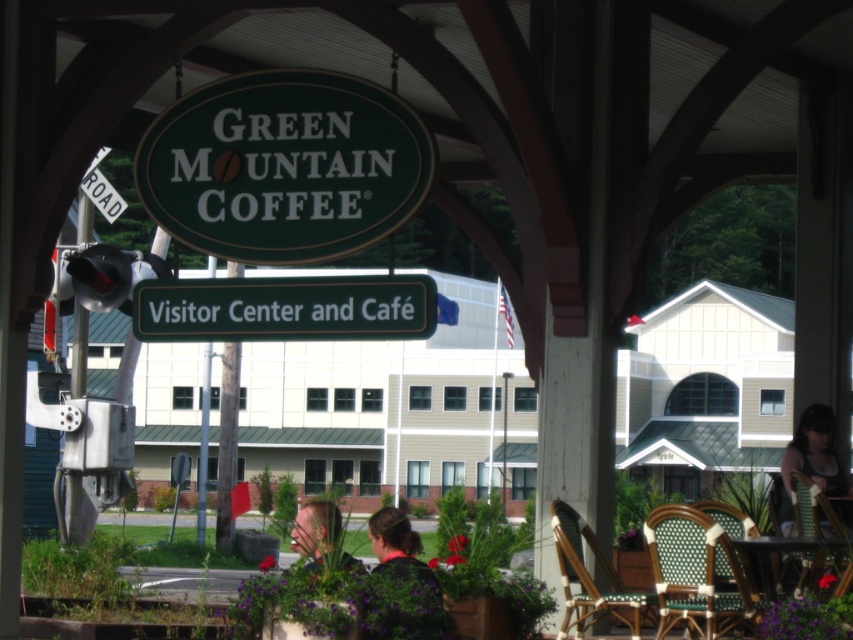
Can you confirm if matte black tank top at lower right is positioned below dark brown hair at lower center?

No.

Between matte black tank top at lower right and dark brown hair at lower center, which one is positioned lower?

dark brown hair at lower center is below.

Between point (828, 440) and point (376, 557), which one is positioned behind?

The point (828, 440) is more distant.

The width and height of the screenshot is (853, 640). What are the coordinates of `matte black tank top at lower right` in the screenshot? It's located at (815, 452).

Can you confirm if dark brown hair at lower center is positioned below wooden table at lower right?

No.

Does dark brown hair at lower center appear on the left side of wooden table at lower right?

Yes, dark brown hair at lower center is to the left of wooden table at lower right.

Who is more distant from viewer, (389,556) or (788,544)?

The point (788,544) is more distant.

Locate an element on the screen. This screenshot has width=853, height=640. dark brown hair at lower center is located at coordinates (397, 545).

Does green matte sign at center appear over dark brown hair at lower center?

Indeed, green matte sign at center is positioned over dark brown hair at lower center.

Based on the photo, who is more distant from viewer, (363, 278) or (399, 541)?

The point (363, 278) is behind.

The height and width of the screenshot is (640, 853). Find the location of `green matte sign at center`. green matte sign at center is located at coordinates (283, 308).